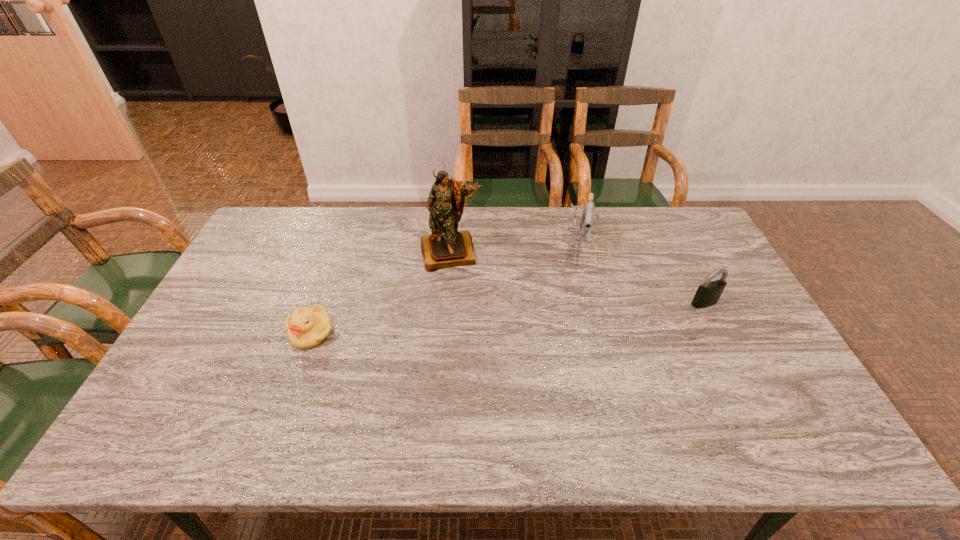
Identify the location of duckling. (307, 328).

Find the location of `the leftmost object`. the leftmost object is located at coordinates (307, 328).

The image size is (960, 540). What are the coordinates of `the third tallest object` in the screenshot? It's located at (707, 294).

Where is `the second nearest object`? Image resolution: width=960 pixels, height=540 pixels. the second nearest object is located at coordinates (707, 294).

Where is `gun`? This screenshot has height=540, width=960. gun is located at coordinates (587, 218).

Find the location of a particular element. This screenshot has width=960, height=540. the second object from right to left is located at coordinates (587, 218).

Identify the location of figurine. (446, 247).

Where is `the tallest object`? This screenshot has height=540, width=960. the tallest object is located at coordinates (446, 247).

Identify the location of free region located 0.150m at the face of the shortest object. (287, 401).

At what (x,y) coordinates should I click in order to perform the action: click on free location located on the back of the second nearest object. Please return your answer as a coordinate pair (x, y). The width and height of the screenshot is (960, 540). Looking at the image, I should click on (679, 252).